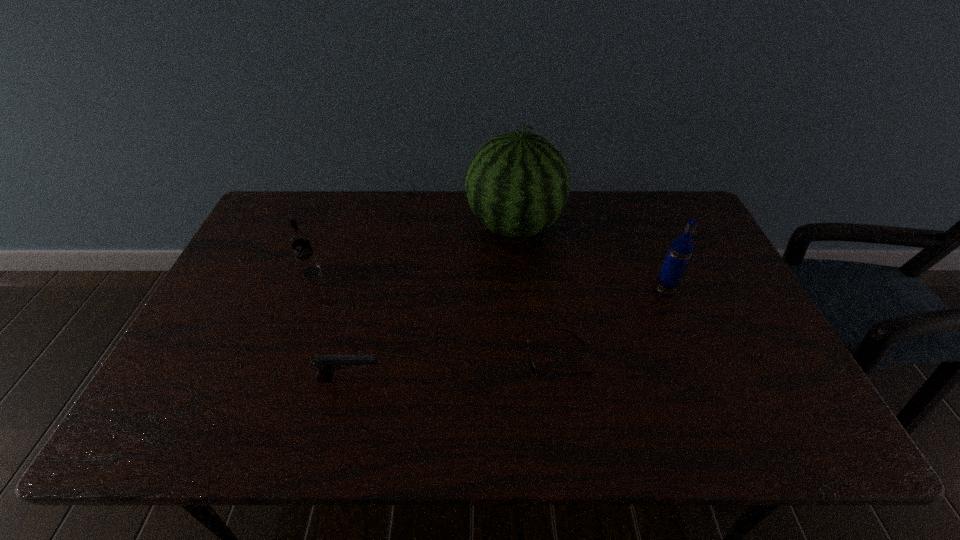
This screenshot has height=540, width=960. In order to click on free space at the far right corner of the desktop in this screenshot , I will do `click(666, 230)`.

At what (x,y) coordinates should I click in order to perform the action: click on vacant space that is in between the fourth tallest object and the nearer vodka. Please return your answer as a coordinate pair (x, y). The height and width of the screenshot is (540, 960). Looking at the image, I should click on (507, 335).

At what (x,y) coordinates should I click in order to perform the action: click on free space between the farthest object and the taller vodka. Please return your answer as a coordinate pair (x, y). This screenshot has height=540, width=960. Looking at the image, I should click on click(x=589, y=258).

Where is `vacant area between the pistol and the right vodka`? The height and width of the screenshot is (540, 960). vacant area between the pistol and the right vodka is located at coordinates (507, 335).

Where is `vacant space that's between the watermelon and the sunglasses`? Image resolution: width=960 pixels, height=540 pixels. vacant space that's between the watermelon and the sunglasses is located at coordinates (536, 293).

The width and height of the screenshot is (960, 540). In order to click on vacant area that lies between the shortest object and the second shortest object in this screenshot , I will do `click(453, 369)`.

Where is `free space between the sunglasses and the tallest object`? free space between the sunglasses and the tallest object is located at coordinates (536, 293).

Locate an element on the screen. This screenshot has height=540, width=960. vacant area between the leftmost object and the second tallest object is located at coordinates (488, 281).

The width and height of the screenshot is (960, 540). What are the coordinates of `free space between the second object from left to right and the third tallest object` in the screenshot? It's located at (330, 326).

At what (x,y) coordinates should I click in order to perform the action: click on free space that is in between the fourth tallest object and the farthest object. Please return your answer as a coordinate pair (x, y). The height and width of the screenshot is (540, 960). Looking at the image, I should click on (432, 303).